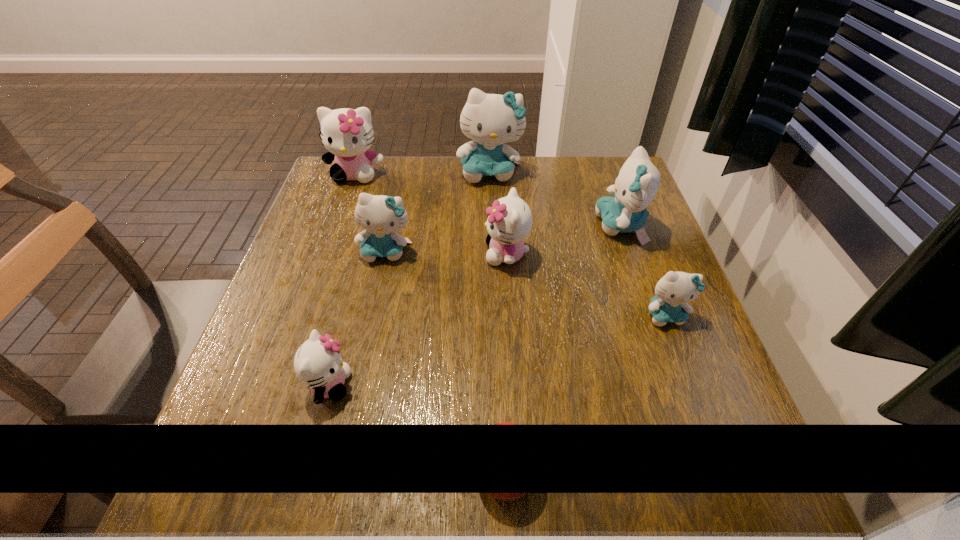
At what (x,y) coordinates should I click in order to perform the action: click on blank space located on the front-facing side of the rightmost white kitten. Please return your answer as a coordinate pair (x, y). This screenshot has width=960, height=540. Looking at the image, I should click on (322, 254).

You are a GUI agent. You are given a task and a screenshot of the screen. Output one action in this format:
    pyautogui.click(x=<x>, y=<y>)
    Task: Click on the free spot located on the face of the leftmost blue kitten
    This screenshot has height=540, width=960.
    Given the screenshot: What is the action you would take?
    pyautogui.click(x=370, y=327)

I want to click on free spot located on the front-facing side of the nearest kitten, so click(535, 386).

Find the location of `vacant space positioned 0.130m on the face of the sixth farthest object`. vacant space positioned 0.130m on the face of the sixth farthest object is located at coordinates (693, 390).

This screenshot has width=960, height=540. In order to click on vacant space located on the back of the nearest object in this screenshot , I will do `click(502, 393)`.

Locate an element on the screen. object present at the near edge is located at coordinates (505, 423).

Locate an element on the screen. This screenshot has width=960, height=540. object present at the far left corner is located at coordinates (347, 134).

In the image, there is a desktop. Where is `vacant space at the far edge`? This screenshot has width=960, height=540. vacant space at the far edge is located at coordinates (535, 182).

Where is `vacant space at the near edge`? The image size is (960, 540). vacant space at the near edge is located at coordinates (609, 468).

This screenshot has width=960, height=540. In order to click on free space at the left edge of the desktop in this screenshot , I will do `click(360, 266)`.